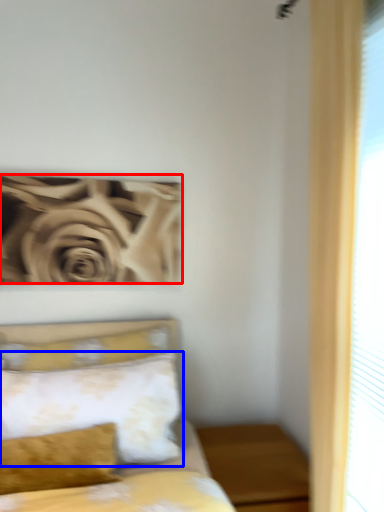
Question: Which object appears farthest to the camera in this image, rose (highlighted by a red box) or pillow (highlighted by a blue box)?

Choices:
 (A) rose
 (B) pillow

Answer: (A)